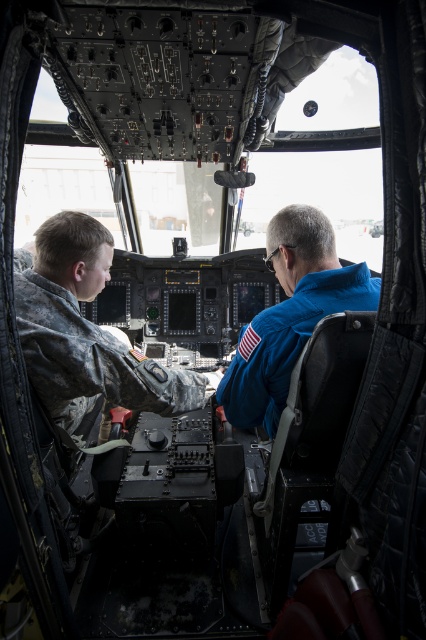
Question: Can you confirm if camouflage fabric uniform at left is smaller than blue smooth jacket at center?

Choices:
 (A) yes
 (B) no

Answer: (B)

Question: Does camouflage fabric uniform at left have a larger size compared to blue smooth jacket at center?

Choices:
 (A) no
 (B) yes

Answer: (B)

Question: In this image, where is camouflage fabric uniform at left located relative to blue smooth jacket at center?

Choices:
 (A) right
 (B) left

Answer: (B)

Question: Which object appears closest to the camera in this image?

Choices:
 (A) blue smooth jacket at center
 (B) camouflage fabric uniform at left

Answer: (B)